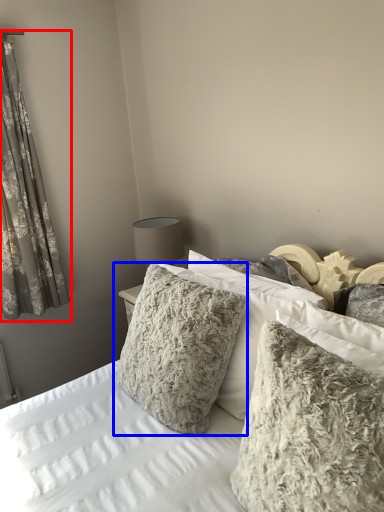
Question: Which object is closer to the camera taking this photo, curtain (highlighted by a red box) or pillow (highlighted by a blue box)?

Choices:
 (A) curtain
 (B) pillow

Answer: (B)